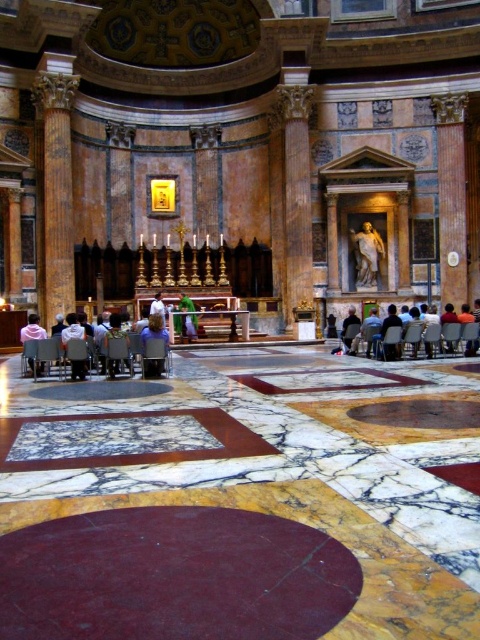
Question: Is matte gray chair at center to the left of white fabric at center from the viewer's perspective?

Choices:
 (A) no
 (B) yes

Answer: (A)

Question: Which point is farther to the camera?

Choices:
 (A) (122, 340)
 (B) (181, 305)
 (C) (84, 323)
 (D) (40, 365)

Answer: (B)

Question: Which object is farther from the camera taking this photo?

Choices:
 (A) dark gray fabric chair at lower right
 (B) white fabric at center
 (C) light gray fabric chairs at lower left

Answer: (B)

Question: Which point is farther to the camera?

Choices:
 (A) light pink fabric at lower left
 (B) white fabric at center
 (C) light gray fabric chairs at lower left

Answer: (B)

Question: Is the position of matte gray chair at center less distant than that of white fabric at center?

Choices:
 (A) no
 (B) yes

Answer: (B)

Question: Does light gray fabric chairs at lower left have a lesser width compared to matte gray chair at center?

Choices:
 (A) no
 (B) yes

Answer: (A)